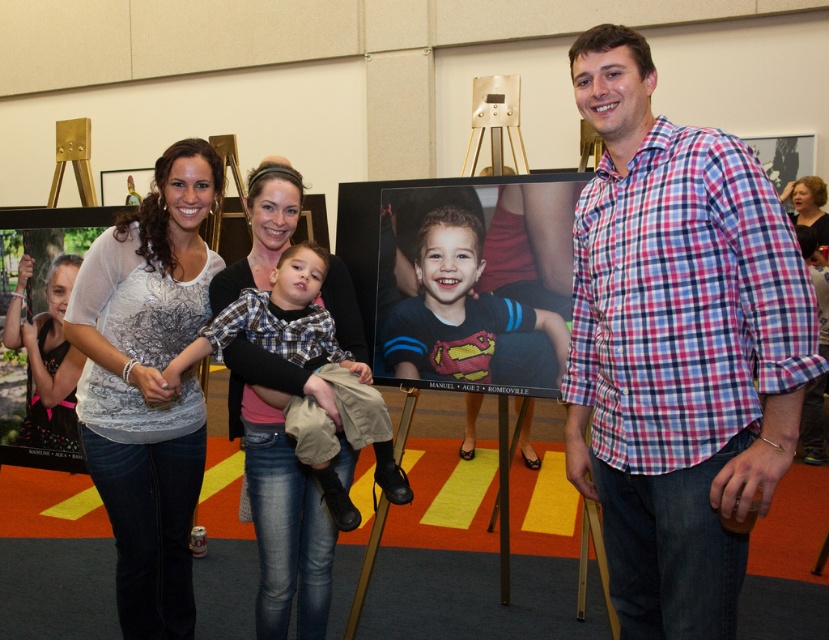
Between matte plastic photo frame at center and plaid fabric shirt at center, which one is positioned higher?

Positioned higher is matte plastic photo frame at center.

Identify the location of matte plastic photo frame at center. (456, 308).

Who is taller, matte plastic photo frame at center or matte black shirt at left?

matte black shirt at left is taller.

Can you confirm if matte plastic photo frame at center is positioned to the left of matte black shirt at left?

Incorrect, matte plastic photo frame at center is not on the left side of matte black shirt at left.

Which is in front, point (430, 352) or point (62, 408)?

Positioned in front is point (430, 352).

The width and height of the screenshot is (829, 640). What are the coordinates of `matte plastic photo frame at center` in the screenshot? It's located at (456, 308).

How far apart are plaid fabric shirt at center and matte black hair at upper right?

They are 4.14 meters apart.

Can you confirm if plaid fabric shirt at center is smaller than matte black hair at upper right?

Incorrect, plaid fabric shirt at center is not smaller in size than matte black hair at upper right.

Is point (362, 433) positioned in front of point (797, 202)?

Yes, it is.

Locate an element on the screen. plaid fabric shirt at center is located at coordinates (277, 320).